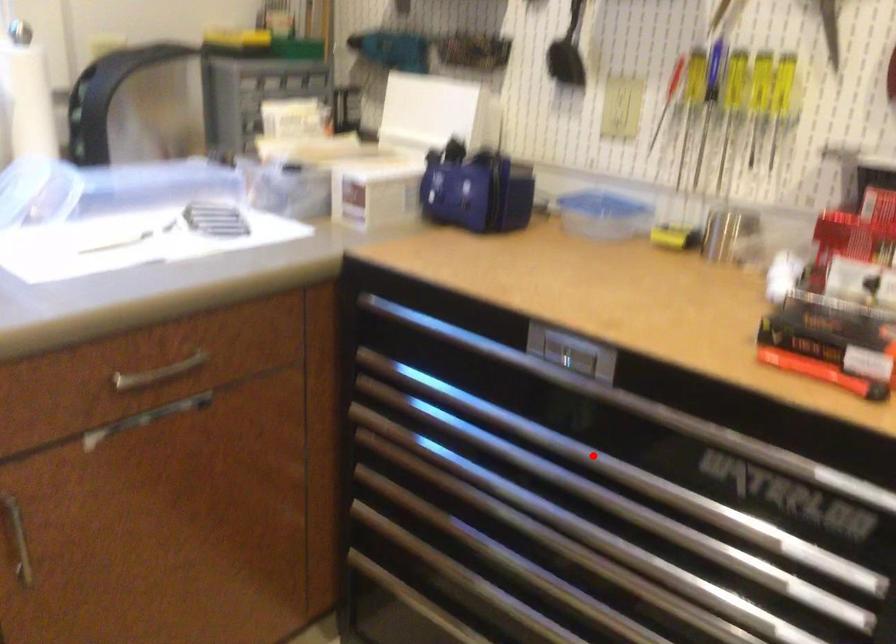
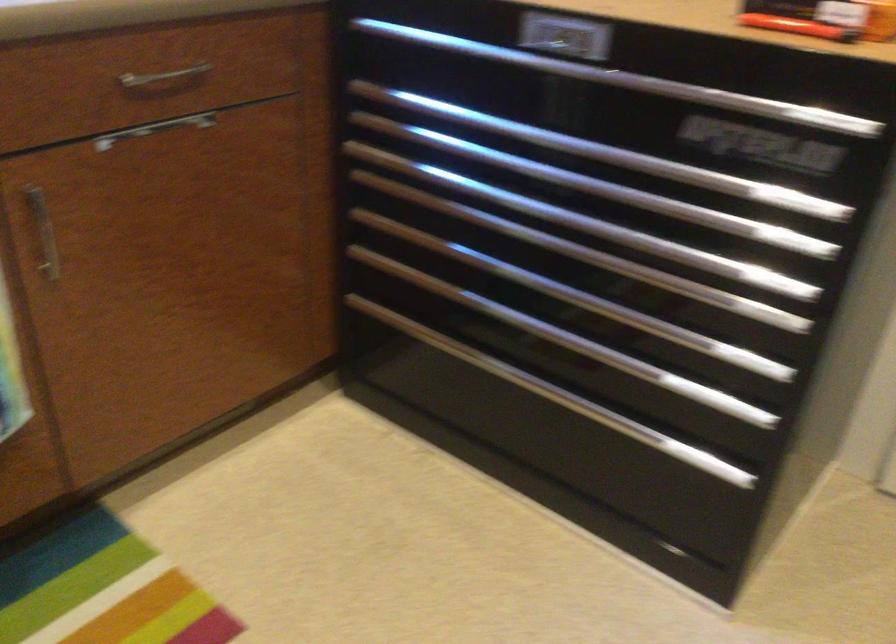
In the second image, find the point that corresponds to the highlighted location in the first image.

(580, 144)